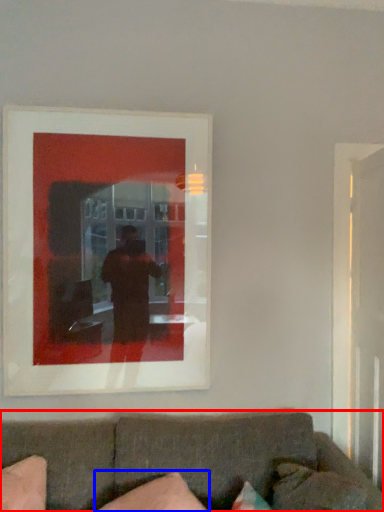
Question: Which of the following is the closest to the observer, studio couch (highlighted by a red box) or pillow (highlighted by a blue box)?

Choices:
 (A) studio couch
 (B) pillow

Answer: (A)